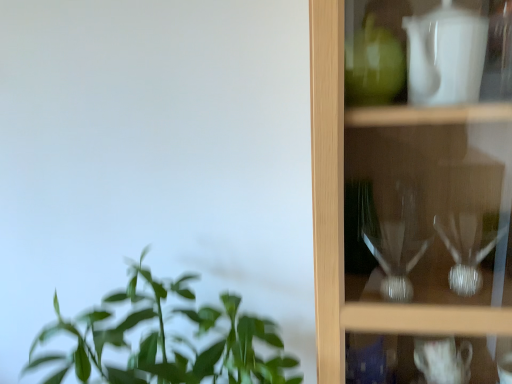
Where is `green leafy plant at lower left`? green leafy plant at lower left is located at coordinates (166, 340).

Describe the element at coordinates (166, 340) in the screenshot. This screenshot has width=512, height=384. I see `green leafy plant at lower left` at that location.

At what (x,y) coordinates should I click in order to perform the action: click on green leafy plant at lower left. Please return your answer as a coordinate pair (x, y). The width and height of the screenshot is (512, 384). Looking at the image, I should click on (166, 340).